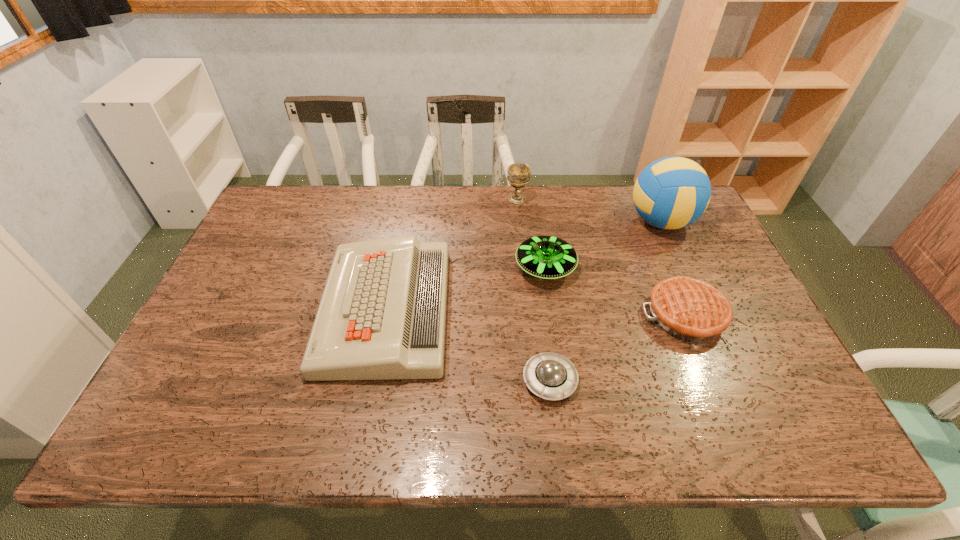
At what (x,y) coordinates should I click in order to perform the action: click on free region located 0.320m on the left of the pie. Please return your answer as a coordinate pair (x, y). Image resolution: width=960 pixels, height=540 pixels. Looking at the image, I should click on (522, 315).

What are the coordinates of `vacant space located 0.180m on the right of the leftmost object` in the screenshot? It's located at (515, 309).

This screenshot has height=540, width=960. What are the coordinates of `free space located 0.320m on the back of the shorter saucer` in the screenshot? It's located at (536, 266).

Identify the location of volleyball present at the far edge. The width and height of the screenshot is (960, 540). (670, 193).

This screenshot has height=540, width=960. I want to click on chalice located at the far edge, so click(x=518, y=174).

Find the location of a particular element. The width and height of the screenshot is (960, 540). volleyball located in the right edge section of the desktop is located at coordinates 670,193.

Find the location of `pie located at the right edge`. pie located at the right edge is located at coordinates (689, 309).

Image resolution: width=960 pixels, height=540 pixels. I want to click on object that is at the far right corner, so click(670, 193).

Find the location of a particular element. free spot at the far edge of the desktop is located at coordinates (366, 204).

The width and height of the screenshot is (960, 540). In the image, there is a desktop. What are the coordinates of `vacant space at the near edge` in the screenshot? It's located at (606, 409).